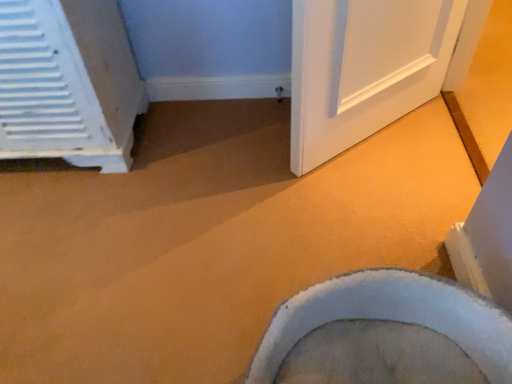
Locate an element on the screen. white plastic radiator at left is located at coordinates (67, 83).

This screenshot has width=512, height=384. Describe the element at coordinates (67, 83) in the screenshot. I see `white plastic radiator at left` at that location.

Image resolution: width=512 pixels, height=384 pixels. In order to click on white soft toilet at lower right in this screenshot , I will do `click(385, 333)`.

What do you see at coordinates (385, 333) in the screenshot?
I see `white soft toilet at lower right` at bounding box center [385, 333].

Locate an element on the screen. The image size is (512, 384). white plastic radiator at left is located at coordinates (67, 83).

Considering the positions of objects white plastic radiator at left and white soft toilet at lower right in the image provided, who is more to the right, white plastic radiator at left or white soft toilet at lower right?

white soft toilet at lower right.

Between white plastic radiator at left and white soft toilet at lower right, which one is positioned behind?

Positioned behind is white plastic radiator at left.

Considering the points (53, 127) and (377, 334), which point is in front, point (53, 127) or point (377, 334)?

The point (377, 334) is closer.

From the image's perspective, which is below, white plastic radiator at left or white soft toilet at lower right?

white soft toilet at lower right.

From a real-world perspective, which object rests below the other?

white soft toilet at lower right.

Between white plastic radiator at left and white soft toilet at lower right, which one has larger width?

white soft toilet at lower right.

Considering the sizes of objects white plastic radiator at left and white soft toilet at lower right in the image provided, who is shorter, white plastic radiator at left or white soft toilet at lower right?

Standing shorter between the two is white soft toilet at lower right.

Considering the relative sizes of white plastic radiator at left and white soft toilet at lower right in the image provided, is white plastic radiator at left bigger than white soft toilet at lower right?

Yes.

Can we say white plastic radiator at left lies outside white soft toilet at lower right?

white plastic radiator at left lies outside white soft toilet at lower right's area.

Is white plastic radiator at left positioned far away from white soft toilet at lower right?

Yes, white plastic radiator at left and white soft toilet at lower right are quite far apart.

Is white plastic radiator at left facing away from white soft toilet at lower right?

No, white plastic radiator at left is not facing away from white soft toilet at lower right.

Where is `toilet that appears on the right of white plastic radiator at left`? toilet that appears on the right of white plastic radiator at left is located at coordinates (385, 333).

Which is more to the right, white soft toilet at lower right or white plastic radiator at left?

Positioned to the right is white soft toilet at lower right.

Considering the positions of objects white soft toilet at lower right and white plastic radiator at left in the image provided, who is in front, white soft toilet at lower right or white plastic radiator at left?

white soft toilet at lower right.

Is point (256, 370) positioned before point (30, 58)?

Yes, it is in front of point (30, 58).

From the image's perspective, which one is positioned lower, white soft toilet at lower right or white plastic radiator at left?

From the image's view, white soft toilet at lower right is below.

From a real-world perspective, is white soft toilet at lower right positioned over white plastic radiator at left based on gravity?

Actually, white soft toilet at lower right is physically below white plastic radiator at left in the real world.

Can you confirm if white soft toilet at lower right is thinner than white plastic radiator at left?

In fact, white soft toilet at lower right might be wider than white plastic radiator at left.

Does white soft toilet at lower right have a greater height compared to white plastic radiator at left?

Incorrect, the height of white soft toilet at lower right is not larger of that of white plastic radiator at left.

Considering the sizes of objects white soft toilet at lower right and white plastic radiator at left in the image provided, who is bigger, white soft toilet at lower right or white plastic radiator at left?

Bigger between the two is white plastic radiator at left.

Can white plastic radiator at left be found inside white soft toilet at lower right?

No, white plastic radiator at left is located outside of white soft toilet at lower right.

Is white soft toilet at lower right with white plastic radiator at left?

white soft toilet at lower right and white plastic radiator at left are clearly separated.

Is white soft toilet at lower right turned away from white plastic radiator at left?

No, white soft toilet at lower right is not facing the opposite direction of white plastic radiator at left.

Locate an element on the screen. The image size is (512, 384). air conditioning located above the white soft toilet at lower right (from a real-world perspective) is located at coordinates pyautogui.click(x=67, y=83).

The width and height of the screenshot is (512, 384). I want to click on air conditioning on the left of white soft toilet at lower right, so click(x=67, y=83).

Find the location of `toilet in front of the white plastic radiator at left`. toilet in front of the white plastic radiator at left is located at coordinates (385, 333).